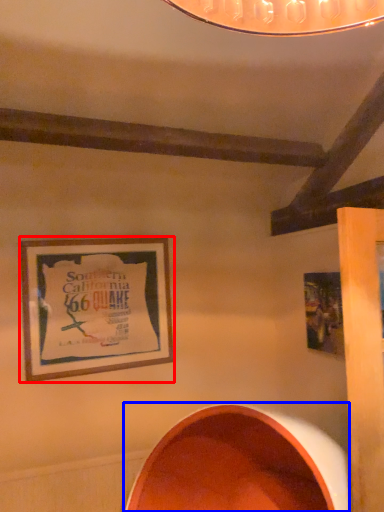
Question: Which of the following is the closest to the observer, picture frame (highlighted by a red box) or oval (highlighted by a blue box)?

Choices:
 (A) picture frame
 (B) oval

Answer: (B)